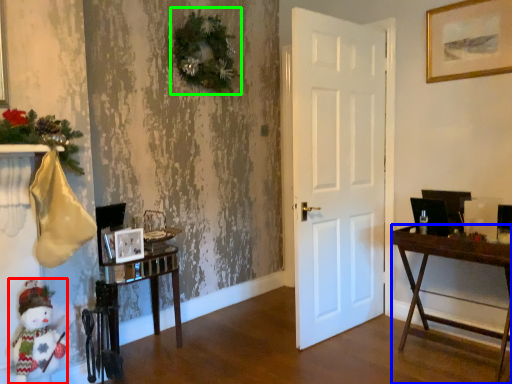
Question: Which object is the farthest from doll (highlighted by a red box)? Choose among these: desk (highlighted by a blue box) or christmas decoration (highlighted by a green box).

Choices:
 (A) desk
 (B) christmas decoration

Answer: (A)